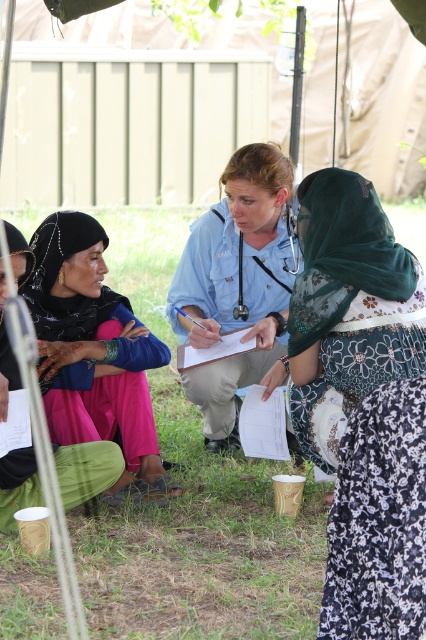
You are a photographer trying to capture a clear shot of the green floral dress at center and the white paper clipboard at center. Which object should you focus on first if you want to ensure both are in focus, considering their sizes?

The green floral dress at center is much taller than the white paper clipboard at center, so you should focus on the larger object first to ensure both are in focus.

You are a photographer trying to capture a photo of the green floral dress at center and the white paper clipboard at center. Which object should you focus on first if you want to include both in your frame without moving the camera?

The green floral dress at center is to the right of the white paper clipboard at center, so you should focus on the white paper clipboard at center first to ensure both are in frame without moving the camera.

You are a photographer trying to capture a clear shot of both the green floral dress at center and the metallic blue stethoscope at center. Which object should you focus on first to ensure it appears sharp in the photo?

The green floral dress at center is taller than the metallic blue stethoscope at center, so you should focus on the green floral dress at center first to ensure depth of field captures both objects properly.